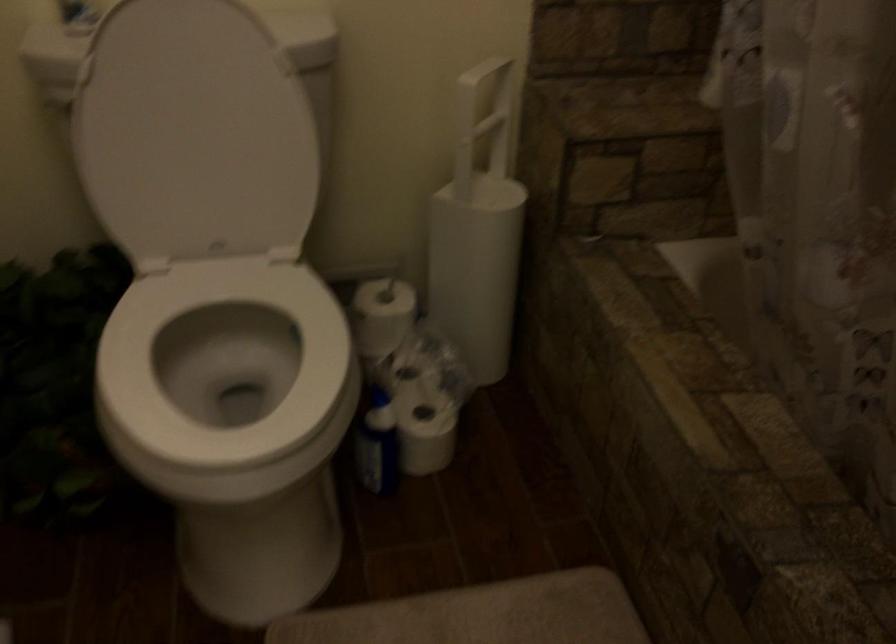
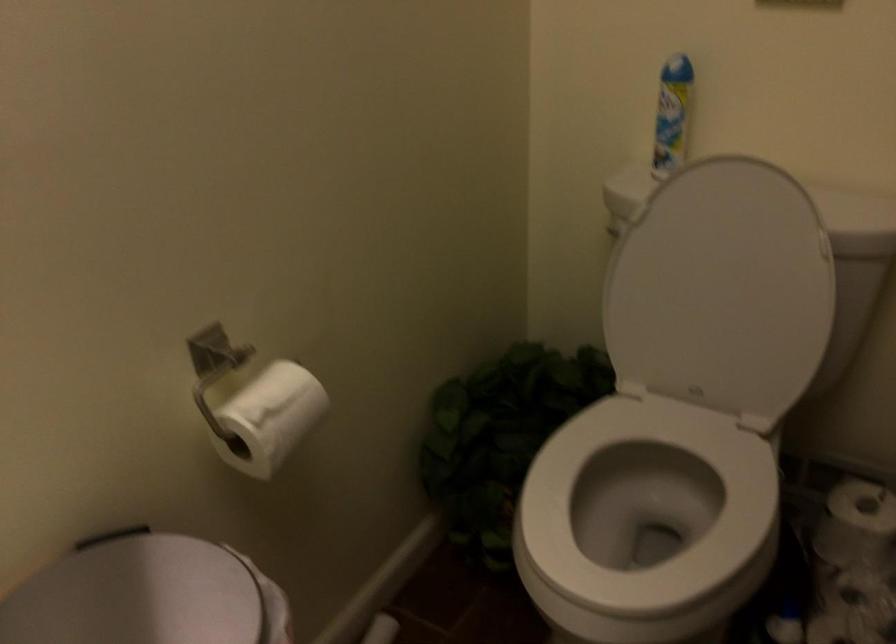
The point at (226, 383) is marked in the first image. Where is the corresponding point in the second image?

(645, 516)